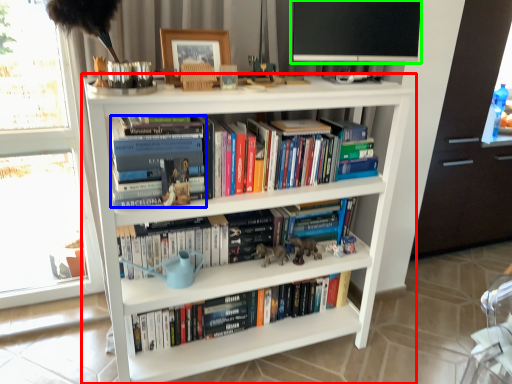
Question: Based on their relative distances, which object is nearer to shelf (highlighted by a red box)? Choose from book (highlighted by a blue box) and computer monitor (highlighted by a green box).

Choices:
 (A) book
 (B) computer monitor

Answer: (A)